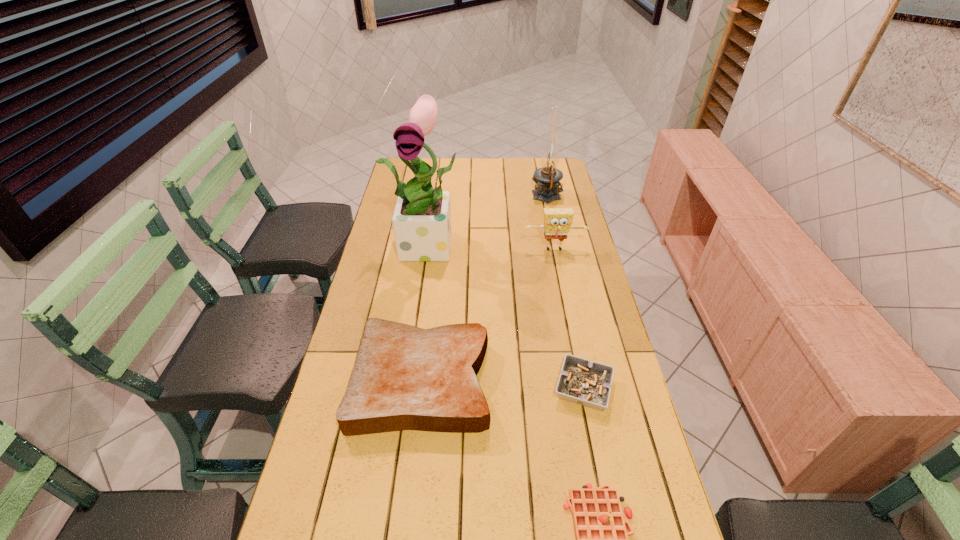
Where is `unoccupied position between the third shortest object and the sponge`? unoccupied position between the third shortest object and the sponge is located at coordinates (488, 315).

The width and height of the screenshot is (960, 540). I want to click on empty space that is in between the bread and the fifth shortest object, so click(x=484, y=289).

I want to click on free space between the flower arrangement and the bread, so click(427, 313).

Find the location of a particular element. This screenshot has width=960, height=540. vacant space that's between the second shortest object and the fourth tallest object is located at coordinates (503, 384).

Where is `blank region between the ashtray and the farthest object`? This screenshot has height=540, width=960. blank region between the ashtray and the farthest object is located at coordinates (565, 293).

You are a GUI agent. You are given a task and a screenshot of the screen. Output one action in this format:
    pyautogui.click(x=<x>, y=<y>)
    Task: Click on the blank region between the third tallest object and the flower arrangement
    The image size is (960, 540).
    Given the screenshot: What is the action you would take?
    pyautogui.click(x=493, y=247)

Choose which object is the second nearest neighbor to the oil lamp. Please provide its 2D coordinates. Your answer should be formatted as a tuple, i.e. [(x, y)], where the tuple contains the x and y coordinates of a point satisfying the conditions above.

[(421, 221)]

Where is `object that is the fifth closest to the bread`? The height and width of the screenshot is (540, 960). object that is the fifth closest to the bread is located at coordinates (547, 178).

Locate an element on the screen. The width and height of the screenshot is (960, 540). free region that satisfies the following two spatial constraints: 1. on the face of the sponge; 2. on the left side of the fifth tallest object is located at coordinates (582, 388).

This screenshot has width=960, height=540. I want to click on vacant area that satisfies the following two spatial constraints: 1. on the front-facing side of the flower arrangement; 2. on the left side of the fifth tallest object, so click(x=413, y=388).